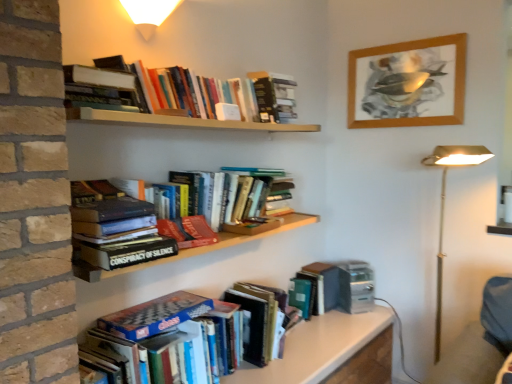
You are a GUI agent. You are given a task and a screenshot of the screen. Output one action in this format:
    pyautogui.click(x=<x>, y=<y>)
    Task: Click on the vacant space to the right of green matte book at lower center, arranged as the sixth book when viewed from the top
    The height and width of the screenshot is (384, 512).
    Given the screenshot: What is the action you would take?
    pyautogui.click(x=351, y=320)